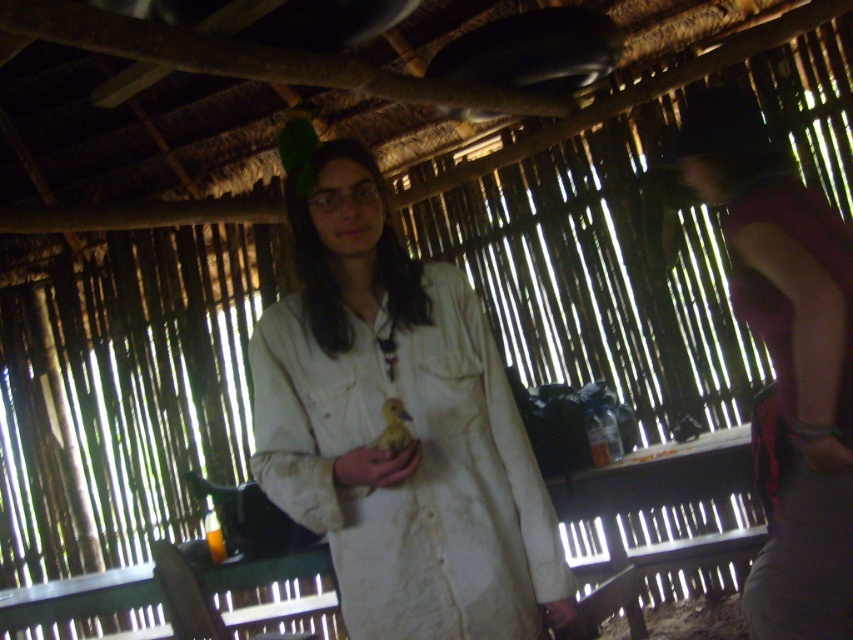
Is white cotton robe at right shorter than smooth yellow duckling at center?

No.

Can you confirm if white cotton robe at right is thinner than smooth yellow duckling at center?

Incorrect, white cotton robe at right's width is not less than smooth yellow duckling at center's.

Is point (816, 397) closer to camera compared to point (370, 445)?

No.

The height and width of the screenshot is (640, 853). I want to click on white cotton robe at right, so click(x=799, y=406).

Which is in front, point (421, 336) or point (409, 472)?

Point (409, 472) is in front.

Which is behind, point (463, 288) or point (370, 464)?

Positioned behind is point (463, 288).

The image size is (853, 640). Identify the location of white cotton shirt at center. (410, 428).

Does white cotton shirt at center appear on the right side of white cotton robe at right?

No, white cotton shirt at center is not to the right of white cotton robe at right.

The height and width of the screenshot is (640, 853). What do you see at coordinates (410, 428) in the screenshot?
I see `white cotton shirt at center` at bounding box center [410, 428].

Identify the location of white cotton shirt at center. (410, 428).